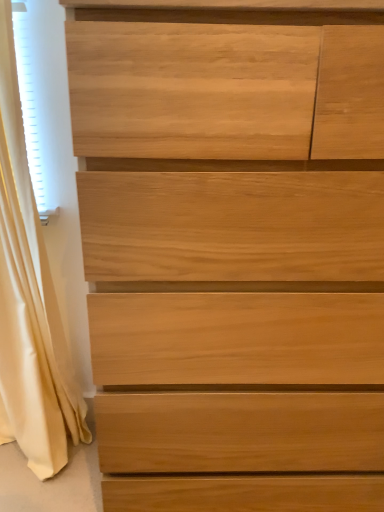
At what (x,y) coordinates should I click in order to perform the action: click on beige fabric curtain at left. Please return your answer as a coordinate pair (x, y). The height and width of the screenshot is (512, 384). Looking at the image, I should click on (29, 302).

Describe the element at coordinates (29, 302) in the screenshot. I see `beige fabric curtain at left` at that location.

Locate an element on the screen. This screenshot has width=384, height=512. beige fabric curtain at left is located at coordinates (29, 302).